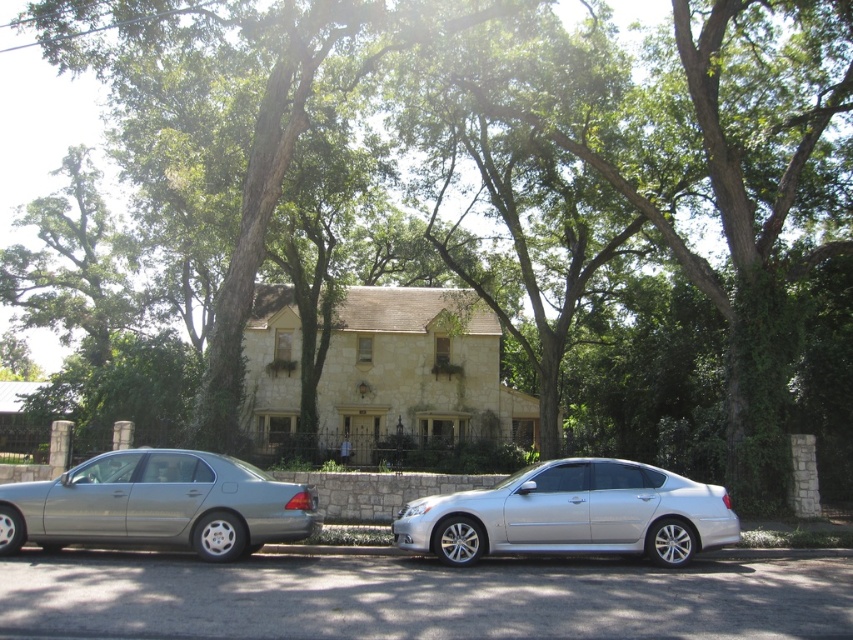
You are standing at the entrance of the house and want to take a photo of the silver metallic sedan at center from the front. Based on its 2D location coordinates, where should you position yourself relative to the house to capture the best frontal view?

To capture the best frontal view of the silver metallic sedan at center, you should position yourself directly in front of the sedan, which is located at the coordinates 0.805 on the x and 0.672 on the y axis. This placement ensures the sedan is centered in your frame while maintaining a clear frontal perspective.

You are a delivery driver approaching the house and need to park your vehicle. The parking spot is directly in front of the house. Which car, the silver metallic sedan at center or the satin silver sedan at left, is closer to the parking spot?

The silver metallic sedan at center is closer to the parking spot because it is positioned above the satin silver sedan at left, indicating it is nearer to the front of the house where the parking spot is located.

You are driving a car that is 5 meters long. You want to park your car between the silver metallic sedan at center and the satin silver sedan at left. Is there enough space between them to fit your car?

The distance between the silver metallic sedan at center and the satin silver sedan at left is 3.43 meters, which is shorter than your car length of 5 meters. Therefore, there is not enough space to park your car between them.